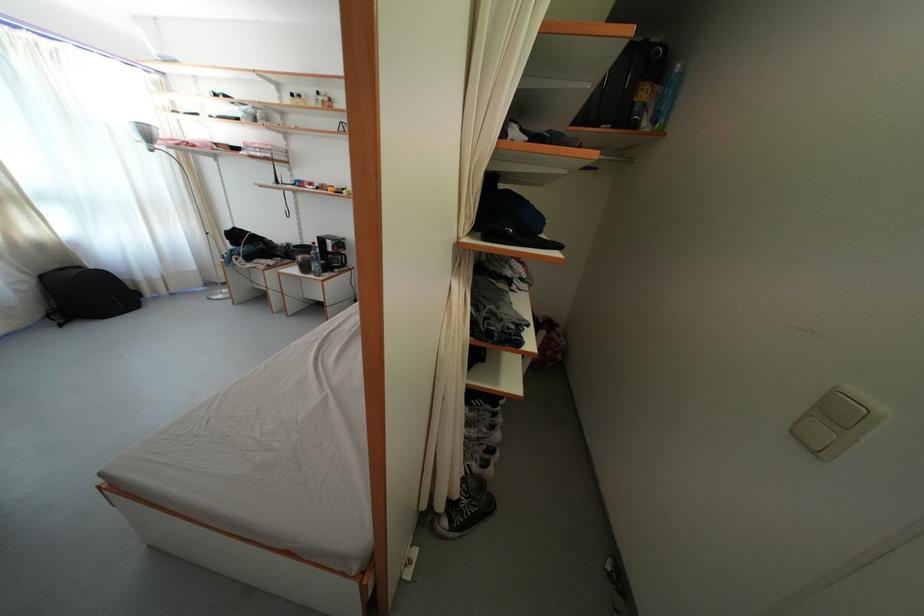
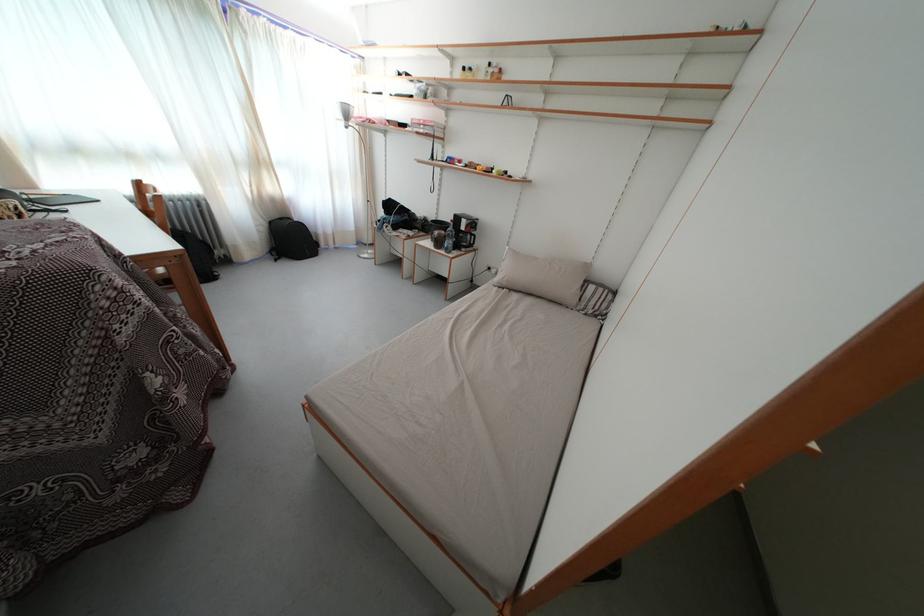
Question: The first image is from the beginning of the video and the second image is from the end. How did the camera likely rotate when shooting the video?

Choices:
 (A) Left
 (B) Right
 (C) Up
 (D) Down

Answer: (A)